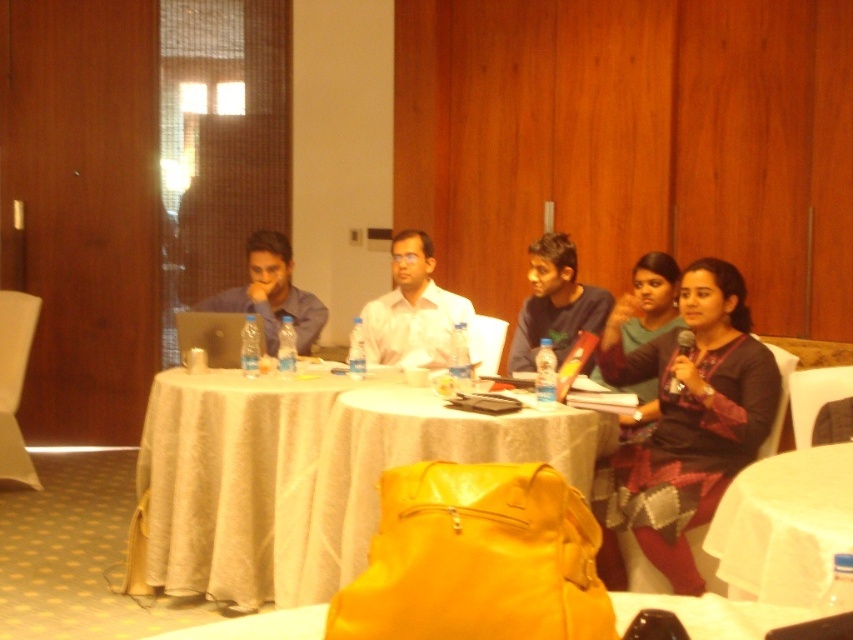
Question: Estimate the real-world distances between objects in this image. Which object is farther from the white fabric tablecloth at center?

Choices:
 (A) yellow fabric table at center
 (B) matte green dress at center
 (C) matte blue shirt at left

Answer: (B)

Question: Where is white fabric tablecloth at center located in relation to matte blue shirt at left in the image?

Choices:
 (A) below
 (B) above

Answer: (A)

Question: Which of the following is the farthest from the observer?

Choices:
 (A) (570, 474)
 (B) (257, 310)

Answer: (B)

Question: Based on their relative distances, which object is nearer to the white cloth table at center?

Choices:
 (A) matte blue shirt at left
 (B) matte green dress at center
 (C) dark green textured dress at center
 (D) white fabric tablecloth at center

Answer: (C)

Question: Can you confirm if matte blue shirt at left is wider than matte green dress at center?

Choices:
 (A) no
 (B) yes

Answer: (B)

Question: From the image, what is the correct spatial relationship of yellow fabric table at center in relation to white cloth table at center?

Choices:
 (A) below
 (B) above

Answer: (A)